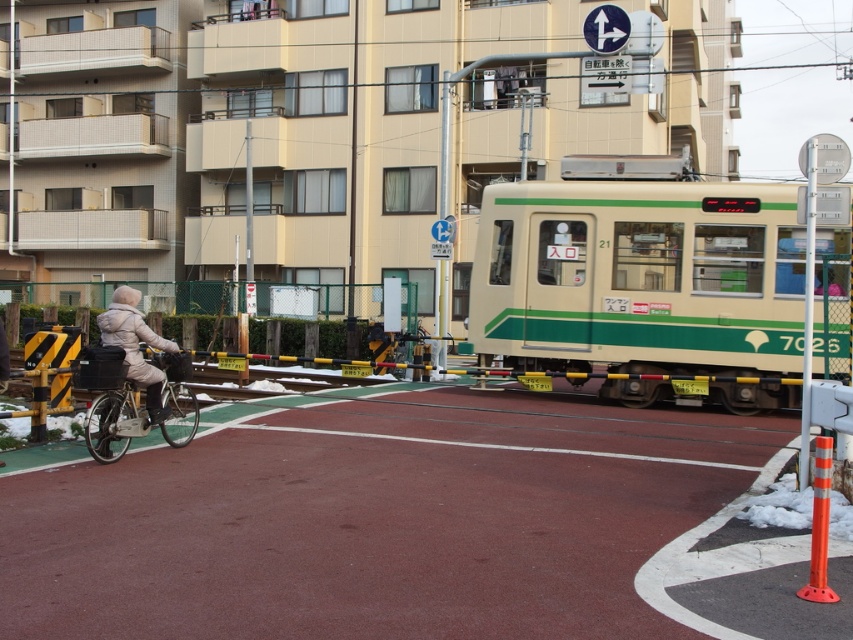
Is matte black bicycle at left positioned behind beige puffy jacket at left?

No, it is not.

Can you confirm if matte black bicycle at left is positioned to the left of beige puffy jacket at left?

No, matte black bicycle at left is not to the left of beige puffy jacket at left.

Does point (167, 384) come farther from viewer compared to point (149, 381)?

That is True.

The width and height of the screenshot is (853, 640). In order to click on matte black bicycle at left in this screenshot , I will do `click(142, 412)`.

Does green matte train at center have a greater height compared to matte black bicycle at left?

Yes, green matte train at center is taller than matte black bicycle at left.

Does green matte train at center have a larger size compared to matte black bicycle at left?

Correct, green matte train at center is larger in size than matte black bicycle at left.

Which is in front, point (711, 298) or point (196, 406)?

Point (196, 406) is in front.

At what (x,y) coordinates should I click in order to perform the action: click on green matte train at center. Please return your answer as a coordinate pair (x, y). The image size is (853, 640). Looking at the image, I should click on (639, 276).

Who is lower down, green matte train at center or beige puffy jacket at left?

beige puffy jacket at left is lower down.

Is green matte train at center thinner than beige puffy jacket at left?

In fact, green matte train at center might be wider than beige puffy jacket at left.

At what (x,y) coordinates should I click in order to perform the action: click on green matte train at center. Please return your answer as a coordinate pair (x, y). Image resolution: width=853 pixels, height=640 pixels. Looking at the image, I should click on (639, 276).